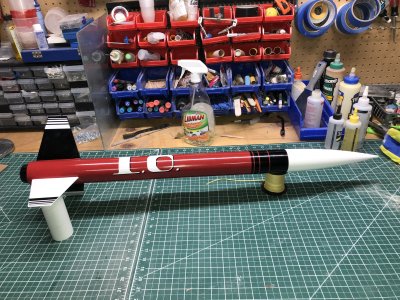
Where is `tubs`? This screenshot has width=400, height=300. tubs is located at coordinates (40, 105).